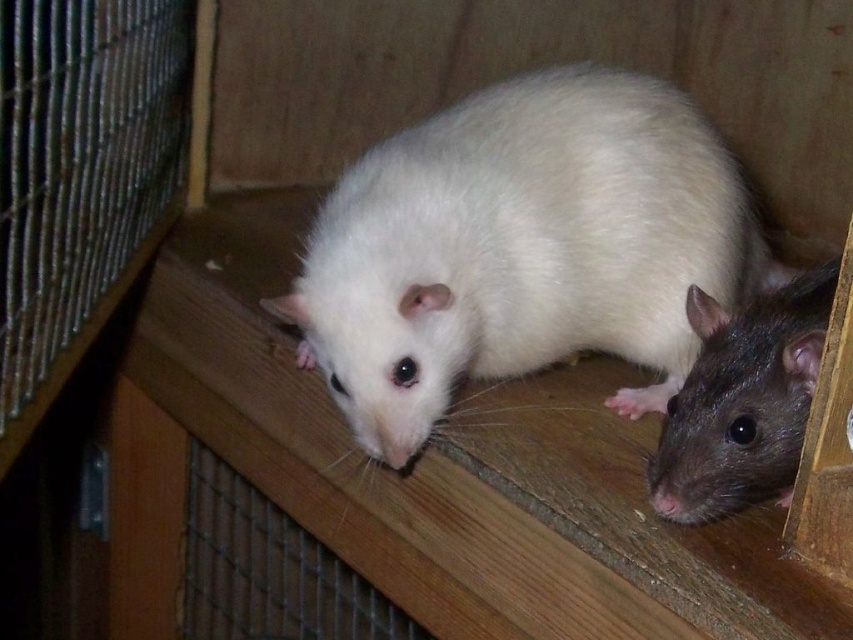
Identify the location of white fluffy hamster at center. This screenshot has width=853, height=640. (521, 248).

At what (x,y) coordinates should I click in order to perform the action: click on white fluffy hamster at center. Please return your answer as a coordinate pair (x, y). Looking at the image, I should click on (521, 248).